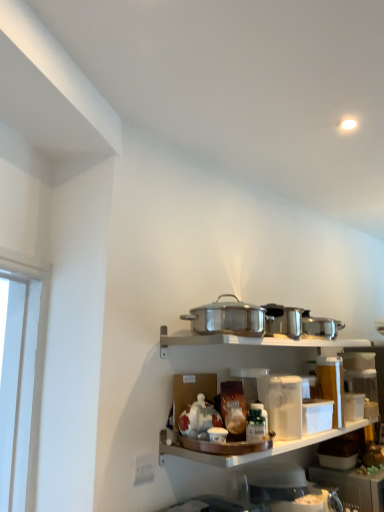
Question: Does white matte container at center have a larger size compared to white plastic container at lower right, placed as the 1th appliance when sorted from back to front?

Choices:
 (A) yes
 (B) no

Answer: (B)

Question: Considering the relative positions of white matte container at center and white plastic container at lower right, which is the second appliance in front-to-back order, in the image provided, is white matte container at center in front of white plastic container at lower right, which is the second appliance in front-to-back order,?

Choices:
 (A) no
 (B) yes

Answer: (B)

Question: Is white matte container at center not within white plastic container at lower right, placed as the 1th appliance when sorted from back to front?

Choices:
 (A) no
 (B) yes

Answer: (B)

Question: Is white matte container at center with white plastic container at lower right, which is the 1th appliance from bottom to top?

Choices:
 (A) yes
 (B) no

Answer: (B)

Question: Is white plastic container at lower right, which is the second appliance in front-to-back order, completely or partially inside white matte container at center?

Choices:
 (A) no
 (B) yes

Answer: (A)

Question: In terms of size, does stainless steel pot at center, arranged as the second appliance when viewed from the back, appear bigger or smaller than white plastic container at lower right, which appears as the second appliance when viewed from the top?

Choices:
 (A) big
 (B) small

Answer: (B)

Question: From the image's perspective, is stainless steel pot at center, which appears as the first appliance when viewed from the front, positioned above or below white plastic container at lower right, placed as the 1th appliance when sorted from back to front?

Choices:
 (A) above
 (B) below

Answer: (A)

Question: Would you say stainless steel pot at center, the first appliance from the top, is inside or outside white plastic container at lower right, which is the 1th appliance from bottom to top?

Choices:
 (A) inside
 (B) outside

Answer: (B)

Question: Considering the positions of stainless steel pot at center, which appears as the first appliance when viewed from the front, and white plastic container at lower right, positioned as the 1th appliance in right-to-left order, in the image, is stainless steel pot at center, which appears as the first appliance when viewed from the front, taller or shorter than white plastic container at lower right, positioned as the 1th appliance in right-to-left order,?

Choices:
 (A) short
 (B) tall

Answer: (A)

Question: Looking at their shapes, would you say white matte container at center is wider or thinner than stainless steel pot at center, which appears as the first appliance when viewed from the front?

Choices:
 (A) thin
 (B) wide

Answer: (B)

Question: Is white matte container at center bigger or smaller than stainless steel pot at center, the first appliance from the top?

Choices:
 (A) small
 (B) big

Answer: (B)

Question: From the image's perspective, is white matte container at center above or below stainless steel pot at center, positioned as the second appliance in bottom-to-top order?

Choices:
 (A) below
 (B) above

Answer: (A)

Question: From a real-world perspective, is white matte container at center above or below stainless steel pot at center, arranged as the first appliance when viewed from the left?

Choices:
 (A) above
 (B) below

Answer: (B)

Question: From the image's perspective, relative to white matte container at center, is white plastic container at lower right, positioned as the 1th appliance in right-to-left order, above or below?

Choices:
 (A) below
 (B) above

Answer: (A)

Question: Is white plastic container at lower right, which is the 1th appliance from bottom to top, spatially inside white matte container at center, or outside of it?

Choices:
 (A) outside
 (B) inside

Answer: (A)